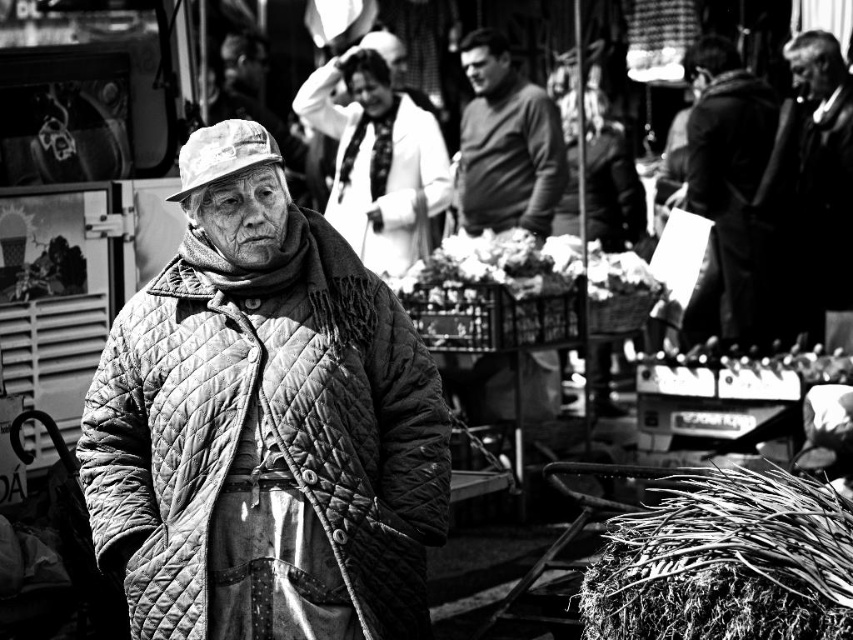
You are a photographer trying to capture the quilted fabric coat at left in your shot. The camera you are using has a rectangular frame with a width of 1 unit and a height of 0.6 units. The point of interest is located at coordinates point [264,422]. Will the quilted fabric coat at left be fully visible within the camera frame?

The point [264,422] corresponds to quilted fabric coat at left, so yes, the quilted fabric coat at left will be fully visible within the camera frame since the point is within the frame dimensions of 1 unit width and 0.6 units height.

You are a photographer trying to capture a closeup of the white textured coat at center and the quilted fabric hat at center. Which object should you zoom in on to ensure both are fully in frame without cropping?

The white textured coat at center is wider than the quilted fabric hat at center, so you should zoom in on the white textured coat at center to ensure both are fully in frame without cropping.

You are an observer in the market scene. You notice the smooth black suit at right and the white fabric hat at center. Which object is positioned farther to the east?

The smooth black suit at right is positioned farther to the east because it is to the right of the white fabric hat at center, and in the scene, right corresponds to east.